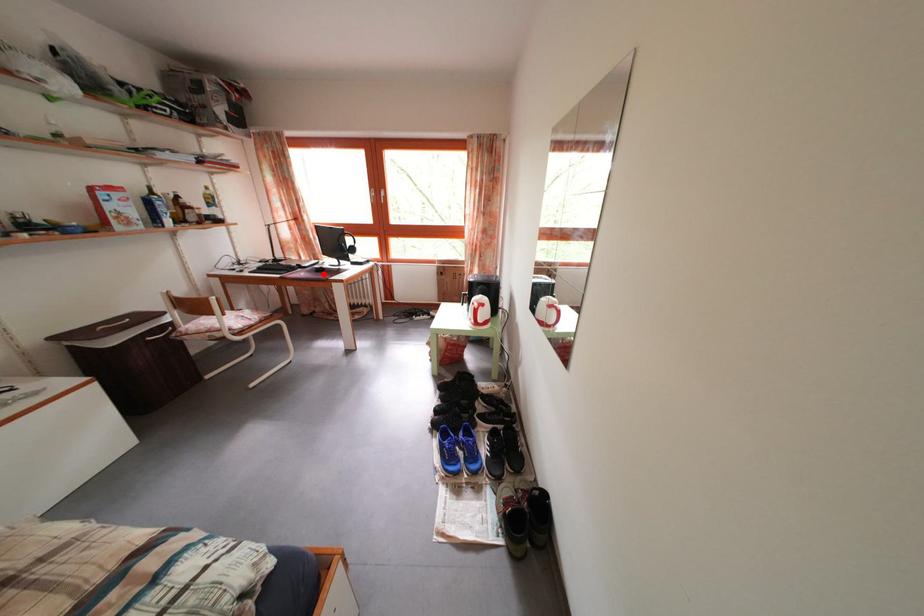
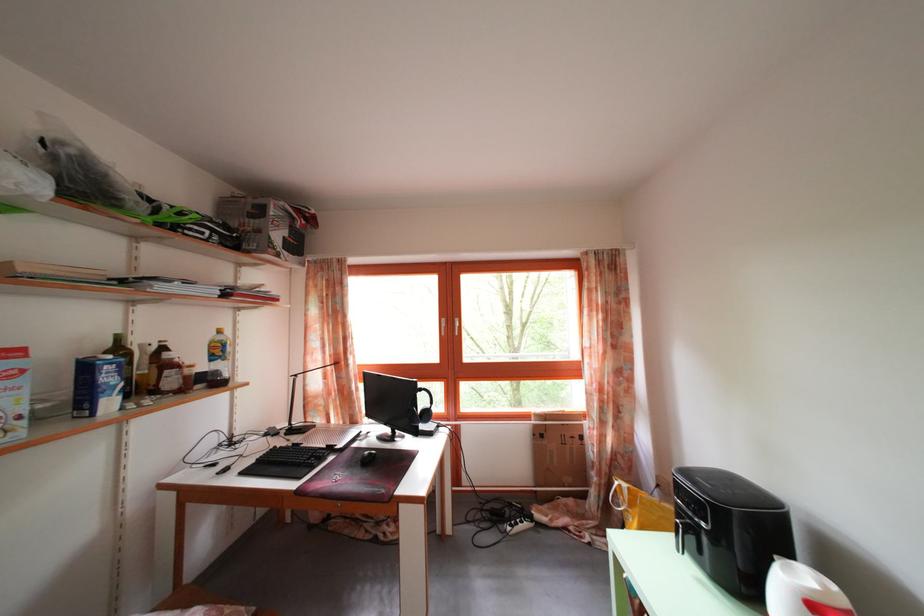
Question: I am providing you with two images of the same scene from different viewpoints. Image1 has a red point marked. In image2, the corresponding 3D location appears at what relative position? Reply with the corresponding letter.

Choices:
 (A) Closer
 (B) Farther

Answer: (B)